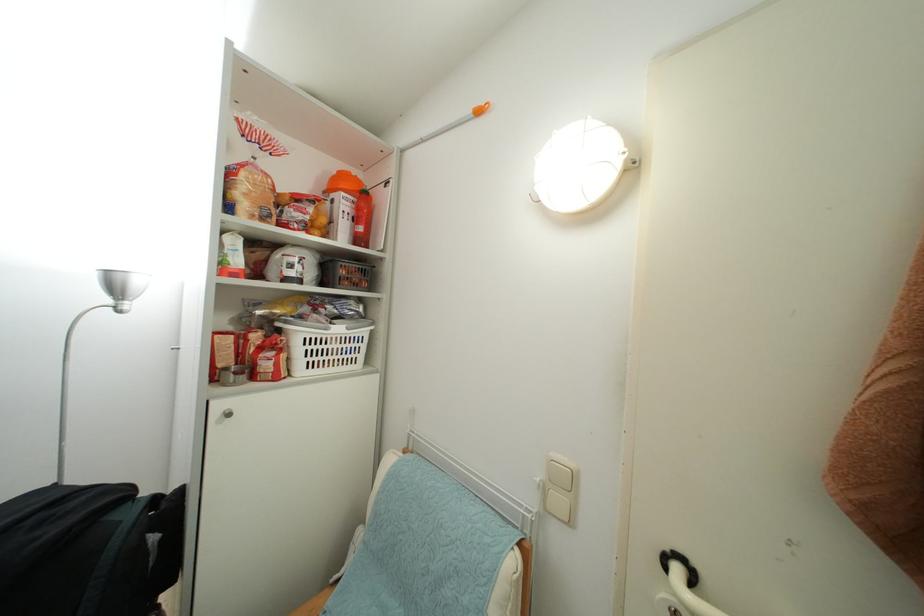
Where is `white plastic basket`? white plastic basket is located at coordinates (323, 345).